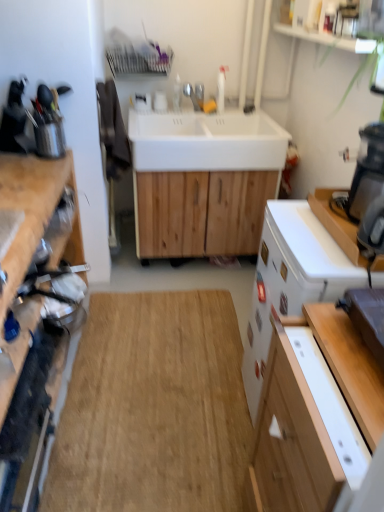
Question: Is natural wood table at center in front of metallic silver knife block at left?

Choices:
 (A) no
 (B) yes

Answer: (B)

Question: Considering the relative positions of natural wood table at center and metallic silver knife block at left in the image provided, is natural wood table at center to the right of metallic silver knife block at left from the viewer's perspective?

Choices:
 (A) yes
 (B) no

Answer: (A)

Question: Does natural wood table at center contain metallic silver knife block at left?

Choices:
 (A) yes
 (B) no

Answer: (B)

Question: Is the position of natural wood table at center more distant than that of metallic silver knife block at left?

Choices:
 (A) yes
 (B) no

Answer: (B)

Question: Can we say natural wood table at center lies outside metallic silver knife block at left?

Choices:
 (A) yes
 (B) no

Answer: (A)

Question: Based on their sizes in the image, would you say metallic silver knife block at left is bigger or smaller than wooden cutting board at left, the 2th cabinetry in the right-to-left sequence?

Choices:
 (A) big
 (B) small

Answer: (B)

Question: Considering their positions, is metallic silver knife block at left located in front of or behind wooden cutting board at left, the 2th cabinetry in the right-to-left sequence?

Choices:
 (A) behind
 (B) front

Answer: (A)

Question: Do you think metallic silver knife block at left is within wooden cutting board at left, placed as the 1th cabinetry when sorted from left to right, or outside of it?

Choices:
 (A) outside
 (B) inside

Answer: (A)

Question: Is metallic silver knife block at left to the left or to the right of wooden cutting board at left, the 2th cabinetry in the right-to-left sequence, in the image?

Choices:
 (A) right
 (B) left

Answer: (B)

Question: Is white glossy dishwasher at right in front of or behind white glossy cabinet at lower right, the second cabinetry positioned from the left, in the image?

Choices:
 (A) front
 (B) behind

Answer: (B)

Question: Does point (294, 271) appear closer or farther from the camera than point (331, 464)?

Choices:
 (A) closer
 (B) farther

Answer: (B)

Question: Choose the correct answer: Is white glossy dishwasher at right inside white glossy cabinet at lower right, the second cabinetry positioned from the left, or outside it?

Choices:
 (A) inside
 (B) outside

Answer: (B)

Question: In terms of height, does white glossy dishwasher at right look taller or shorter compared to white glossy cabinet at lower right, which is the 1th cabinetry from right to left?

Choices:
 (A) short
 (B) tall

Answer: (B)

Question: From the image's perspective, relative to white matte sink at center, arranged as the 1th sink when ordered from the bottom, is white glossy sink at center, which appears as the 1th sink when viewed from the top, above or below?

Choices:
 (A) below
 (B) above

Answer: (B)

Question: In terms of width, does white glossy sink at center, which appears as the 1th sink when viewed from the top, look wider or thinner when compared to white matte sink at center, arranged as the 1th sink when ordered from the bottom?

Choices:
 (A) thin
 (B) wide

Answer: (A)